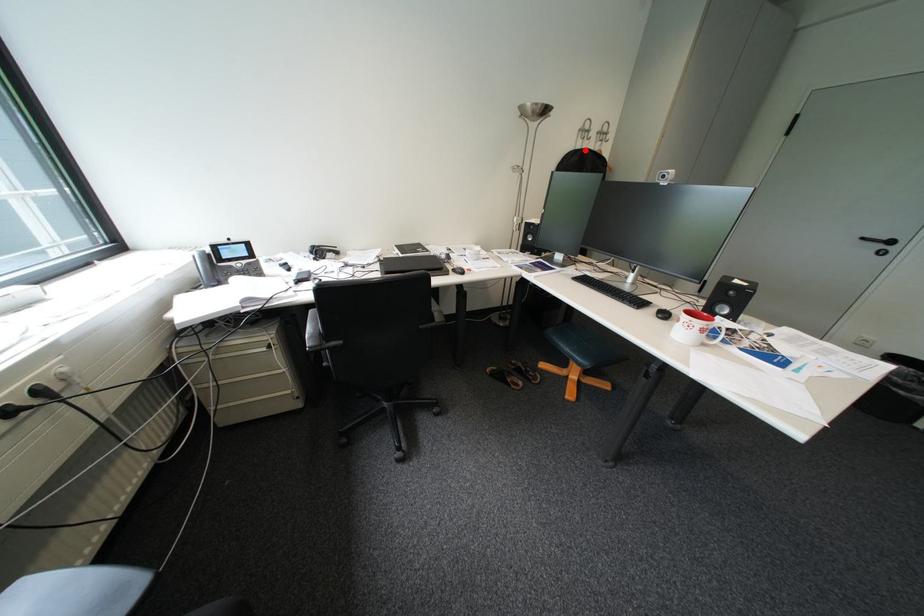
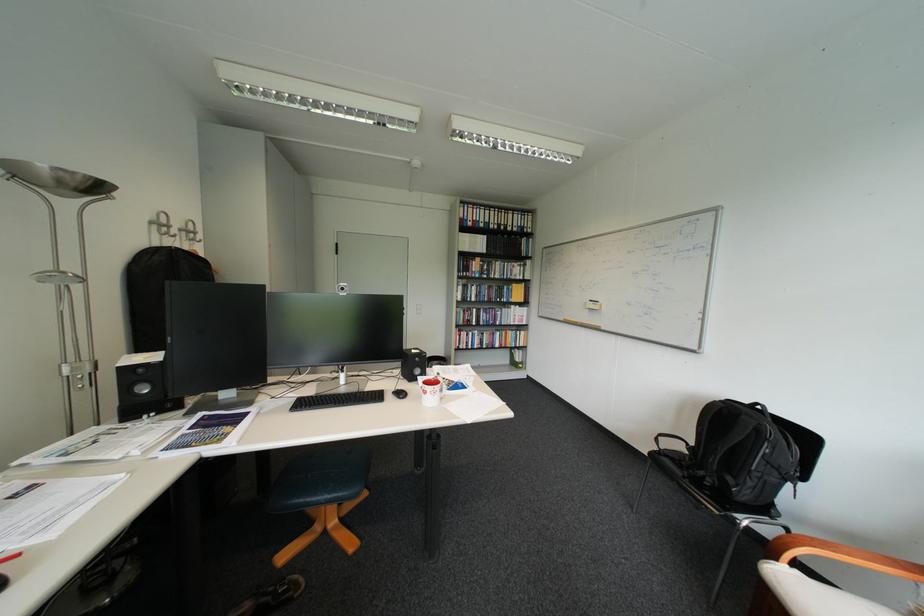
The point at the highlighted location is marked in the first image. Where is the corresponding point in the second image?

(160, 246)